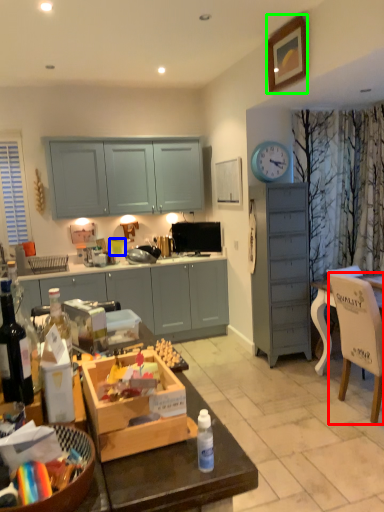
Question: Which is nearer to the chair (highlighted by a red box)? coffee cup (highlighted by a blue box) or picture frame (highlighted by a green box).

Choices:
 (A) coffee cup
 (B) picture frame

Answer: (B)